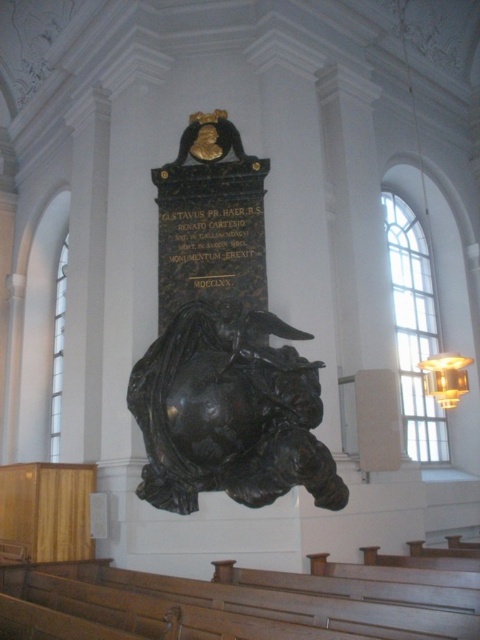
What is the relationship between the sizes of the black polished stone sculpture at center and the black stone plaque at center?

The black polished stone sculpture at center is larger in size than the black stone plaque at center.

You are standing in the grand church and want to take a photo of the monument. You notice two points marked on the floor at coordinates point (x=308, y=368) and point (x=259, y=230). Which point should you stand closer to in order to ensure the monument is fully visible in your photo?

You should stand closer to point (x=308, y=368) because it is closer to the camera than point (x=259, y=230), allowing for a better view of the monument.